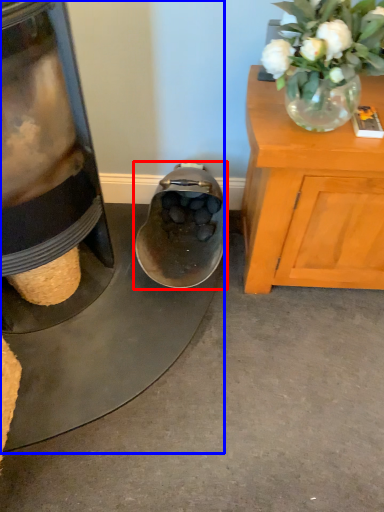
Question: Which of the following is the closest to the observer, footwear (highlighted by a red box) or appliance (highlighted by a blue box)?

Choices:
 (A) footwear
 (B) appliance

Answer: (B)